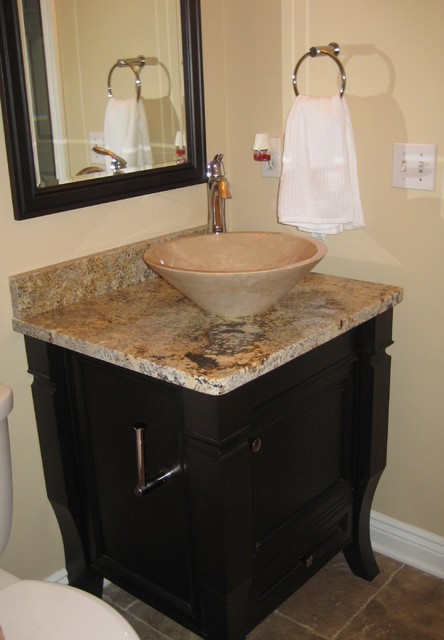
This screenshot has height=640, width=444. I want to click on air freshener, so click(x=261, y=147).